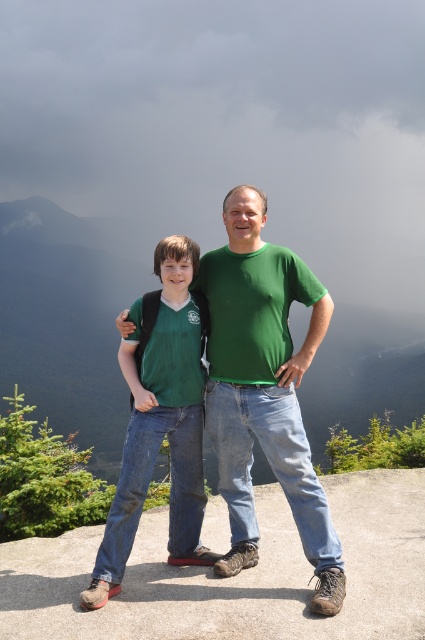
Who is more forward, (314, 563) or (197, 560)?

Positioned in front is point (314, 563).

Who is shorter, green matte t-shirt at center or matte green shirt at center?

matte green shirt at center

Image resolution: width=425 pixels, height=640 pixels. Describe the element at coordinates (263, 388) in the screenshot. I see `green matte t-shirt at center` at that location.

Identify the location of green matte t-shirt at center. (263, 388).